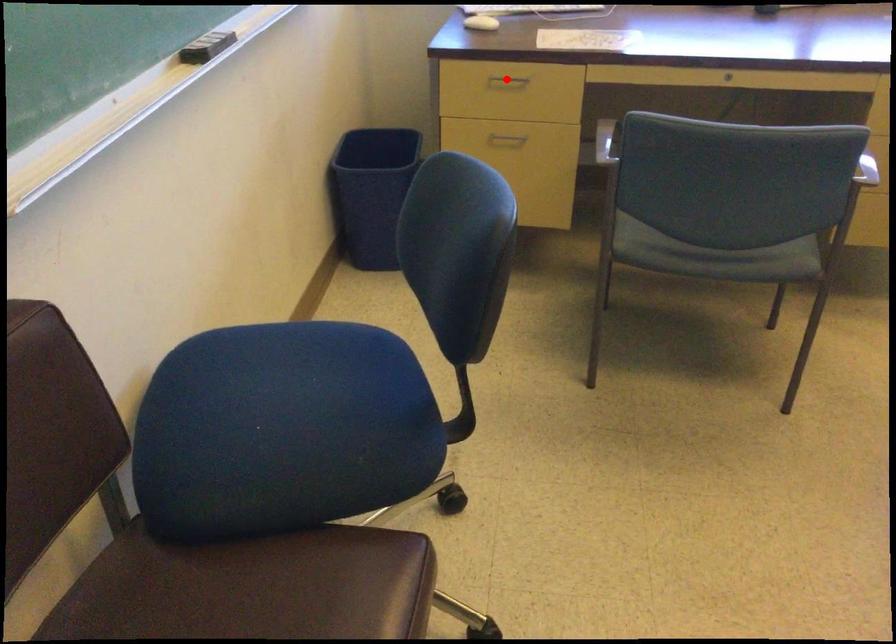
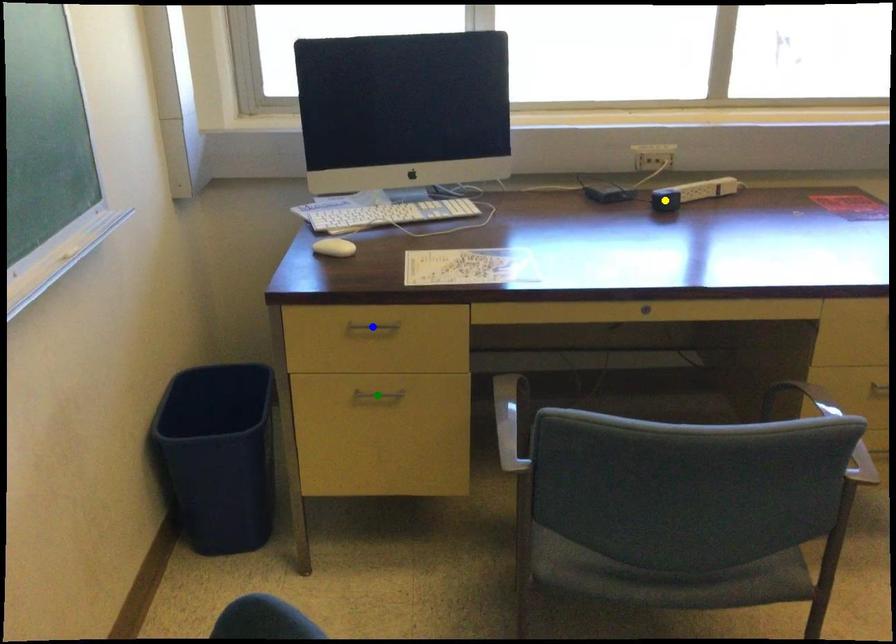
Question: I am providing you with two images of the same scene from different viewpoints. A red point is marked on the first image. You are given multiple points on the second image. Which spot in image 2 lines up with the point in image 1?

Choices:
 (A) green point
 (B) yellow point
 (C) blue point

Answer: (C)